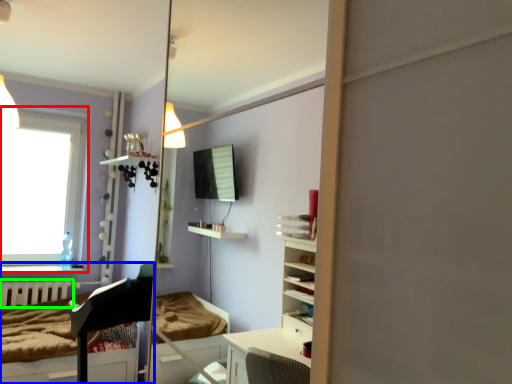
Question: Based on their relative distances, which object is farther from window (highlighted by a red box)? Choose from furniture (highlighted by a blue box) and radiator (highlighted by a green box).

Choices:
 (A) furniture
 (B) radiator

Answer: (A)